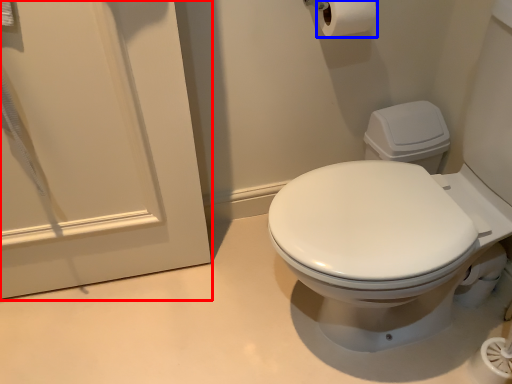
Question: Which point is further to the camera, screen door (highlighted by a red box) or toilet paper (highlighted by a blue box)?

Choices:
 (A) screen door
 (B) toilet paper

Answer: (B)